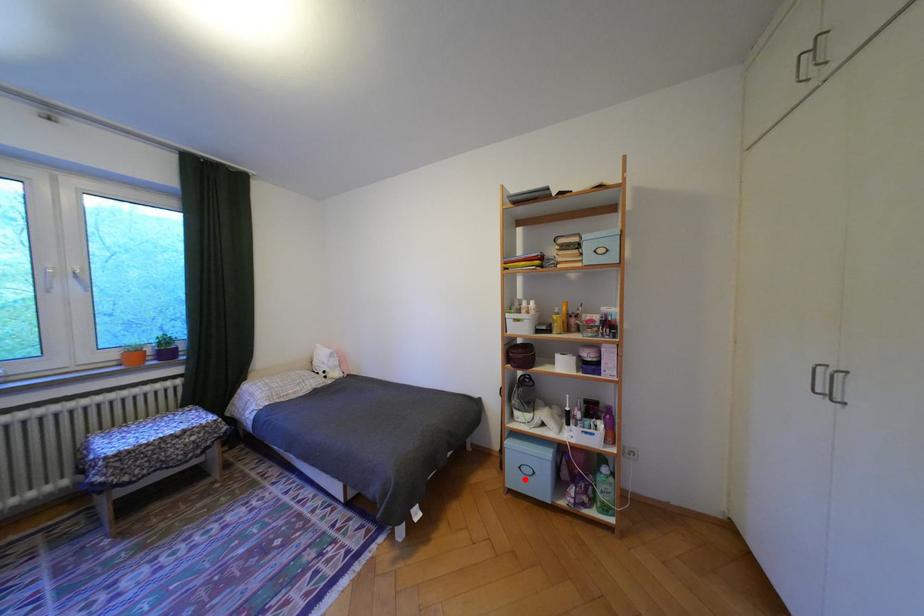
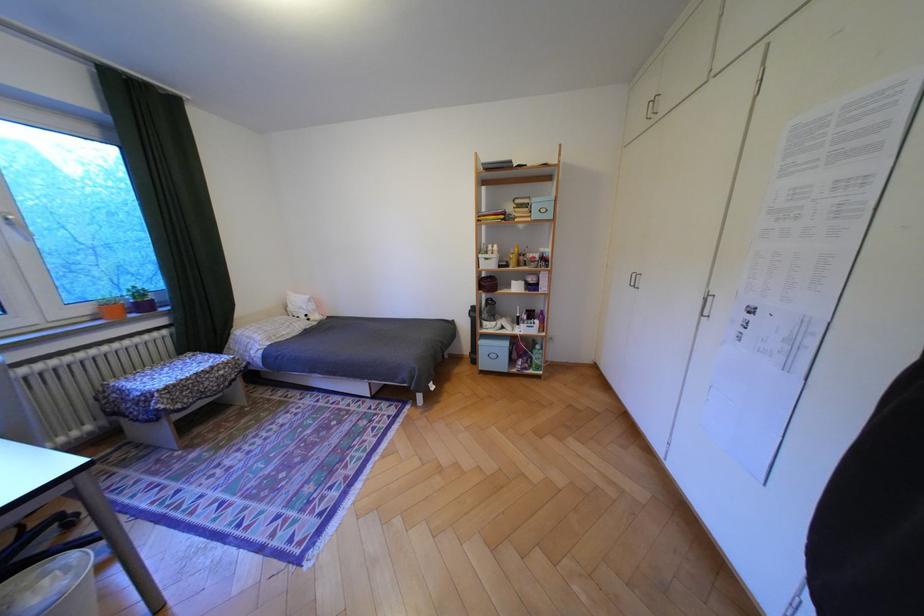
Question: I am providing you with two images of the same scene from different viewpoints. In image1, a red point is highlighted. Considering the same 3D point in image2, which of the following is correct?

Choices:
 (A) It is closer
 (B) It is farther

Answer: (A)